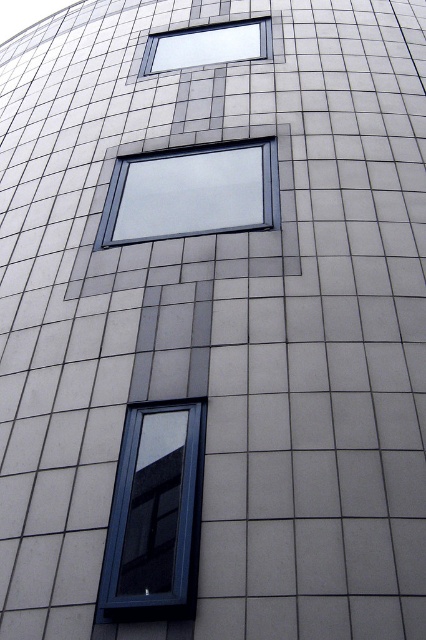
Question: Where is matte black window at lower left located in relation to matte glass window at upper center in the image?

Choices:
 (A) left
 (B) right

Answer: (A)

Question: Considering the relative positions of matte black window at lower left and matte glass window at upper center in the image provided, where is matte black window at lower left located with respect to matte glass window at upper center?

Choices:
 (A) below
 (B) above

Answer: (A)

Question: Which of the following is the farthest from the observer?

Choices:
 (A) (249, 51)
 (B) (163, 186)

Answer: (A)

Question: Which point is closer to the camera?

Choices:
 (A) matte glass window at center
 (B) matte glass window at upper center
 (C) matte black window at lower left

Answer: (C)

Question: Is matte black window at lower left below matte glass window at center?

Choices:
 (A) yes
 (B) no

Answer: (A)

Question: Considering the real-world distances, which object is closest to the matte glass window at upper center?

Choices:
 (A) matte glass window at center
 (B) matte black window at lower left

Answer: (A)